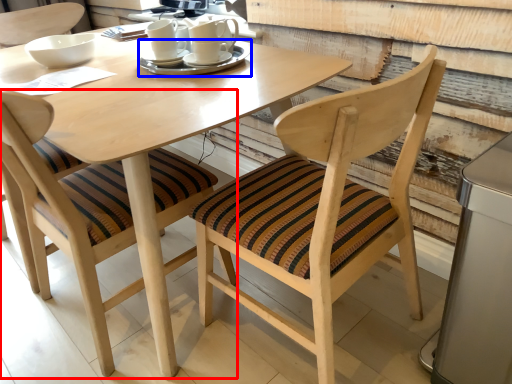
Question: Among these objects, which one is nearest to the camera, chair (highlighted by a red box) or tableware (highlighted by a blue box)?

Choices:
 (A) chair
 (B) tableware

Answer: (A)